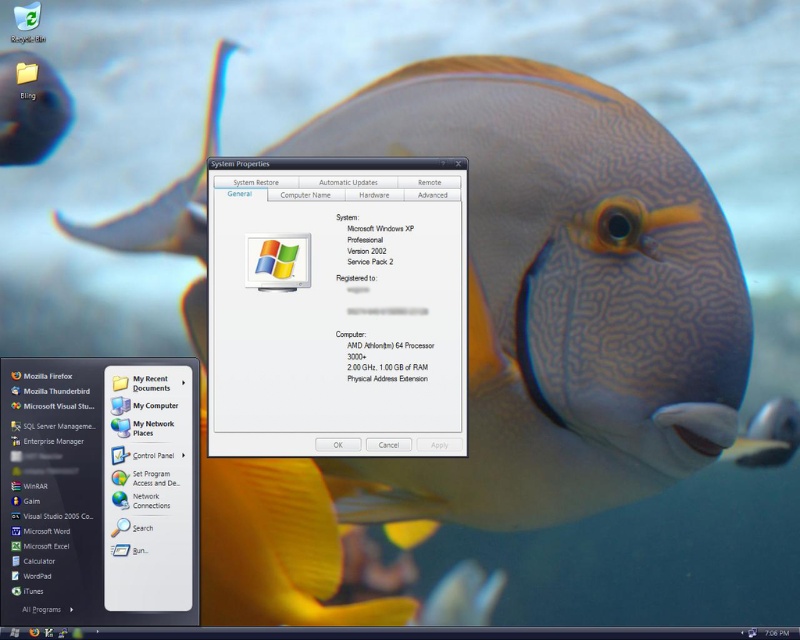
Does smooth gray fish at center have a larger size compared to transparent plastic window at center?

Yes.

Which is more to the right, smooth gray fish at center or transparent plastic window at center?

Positioned to the right is smooth gray fish at center.

Measure the distance between point (x=704, y=301) and camera.

The distance of point (x=704, y=301) from camera is 1.18 meters.

The width and height of the screenshot is (800, 640). I want to click on smooth gray fish at center, so click(x=560, y=296).

Which is more to the left, translucent glass fish at upper left or shiny blue fish at upper left?

shiny blue fish at upper left is more to the left.

Does translucent glass fish at upper left have a larger size compared to shiny blue fish at upper left?

Yes.

What are the coordinates of `translucent glass fish at upper left` in the screenshot? It's located at (166, 195).

The height and width of the screenshot is (640, 800). I want to click on translucent glass fish at upper left, so click(166, 195).

Looking at this image, does smooth gray fish at center have a lesser height compared to shiny blue fish at upper left?

No, smooth gray fish at center is not shorter than shiny blue fish at upper left.

Does point (604, 100) lie in front of point (66, 116)?

Yes, point (604, 100) is closer to viewer.

This screenshot has width=800, height=640. Find the location of `smooth gray fish at center`. smooth gray fish at center is located at coordinates (560, 296).